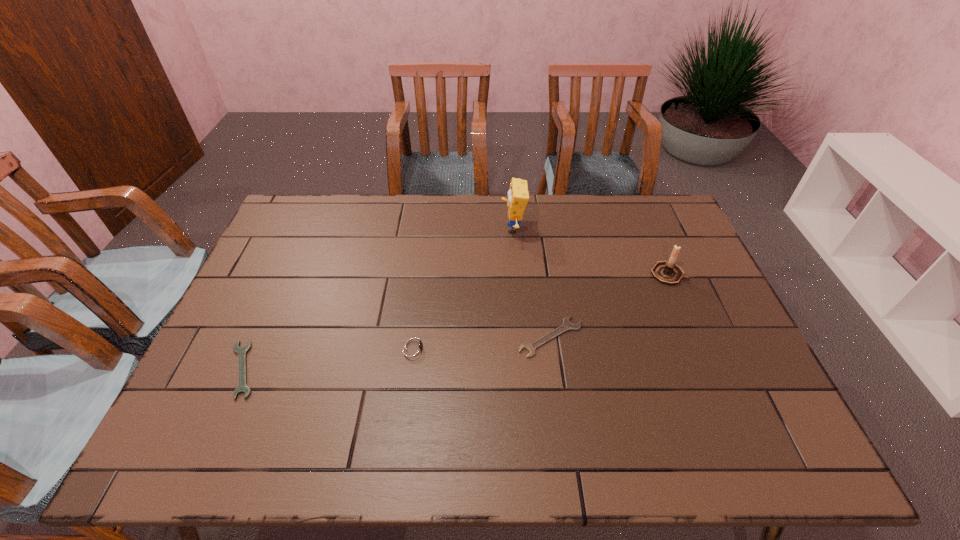
Where is `free space between the sponge and the leftmost object`? free space between the sponge and the leftmost object is located at coordinates (377, 299).

At what (x,y) coordinates should I click in order to perform the action: click on unoccupied position between the third tallest object and the right wrench. Please return your answer as a coordinate pair (x, y). Looking at the image, I should click on (482, 342).

Locate an element on the screen. The height and width of the screenshot is (540, 960). free space that is in between the farthest object and the watch is located at coordinates (464, 288).

At what (x,y) coordinates should I click in order to perform the action: click on the fourth closest object to the left wrench. Please return your answer as a coordinate pair (x, y). Looking at the image, I should click on (667, 272).

Choose which object is the second nearest neighbor to the right wrench. Please provide its 2D coordinates. Your answer should be formatted as a tuple, i.e. [(x, y)], where the tuple contains the x and y coordinates of a point satisfying the conditions above.

[(667, 272)]

I want to click on vacant point that satisfies the following two spatial constraints: 1. on the face of the sponge; 2. on the right side of the candle holder, so click(516, 274).

Find the location of a particular element. This screenshot has height=540, width=960. vacant area in the image that satisfies the following two spatial constraints: 1. on the face of the candle holder; 2. on the right side of the farthest object is located at coordinates (516, 274).

At what (x,y) coordinates should I click in order to perform the action: click on blank space that satisfies the following two spatial constraints: 1. on the face of the sponge; 2. on the left side of the candle holder. Please return your answer as a coordinate pair (x, y). Looking at the image, I should click on (516, 274).

This screenshot has height=540, width=960. In order to click on free location that satisfies the following two spatial constraints: 1. on the face of the sponge; 2. on the back side of the right wrench in this screenshot , I will do `click(521, 337)`.

The width and height of the screenshot is (960, 540). What are the coordinates of `free point that satisfies the following two spatial constraints: 1. on the face of the tallest object; 2. on the front side of the leftmost object` in the screenshot? It's located at (524, 369).